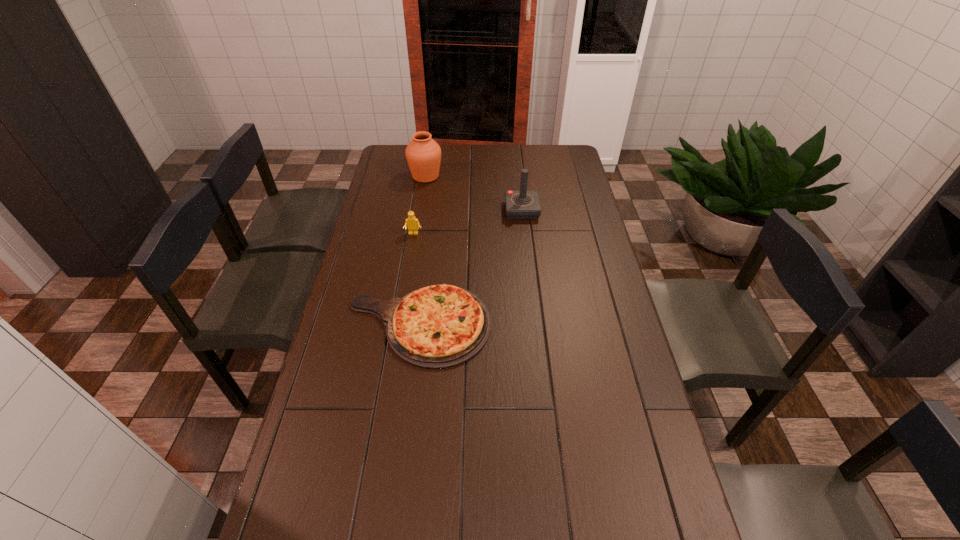
Find the location of a particular element. This screenshot has width=960, height=540. vacant space located on the right of the nearest object is located at coordinates (516, 325).

You are a GUI agent. You are given a task and a screenshot of the screen. Output one action in this format:
    pyautogui.click(x=<x>, y=<y>)
    Task: Click on the object that is at the far edge
    The image size is (960, 540).
    Given the screenshot: What is the action you would take?
    pyautogui.click(x=423, y=154)

You are a GUI agent. You are given a task and a screenshot of the screen. Output one action in this format:
    pyautogui.click(x=<x>, y=<y>)
    Task: Click on the urn located at the left edge
    This screenshot has height=540, width=960.
    Given the screenshot: What is the action you would take?
    pyautogui.click(x=423, y=154)

Identify the location of pizza situated at the left edge. (440, 326).

Find the location of a particular element. The image size is (960, 540). object that is at the far left corner is located at coordinates (423, 154).

This screenshot has width=960, height=540. Identify the location of blank space at the far edge of the desktop. (474, 152).

In order to click on vacant region at the left edge in this screenshot , I will do `click(371, 260)`.

Find the location of `free space at the right edge of the desktop`. free space at the right edge of the desktop is located at coordinates (609, 353).

Find the location of `free point at the far left corner`. free point at the far left corner is located at coordinates (390, 163).

In order to click on free space between the Lego and the nearest object in this screenshot , I will do `click(416, 279)`.